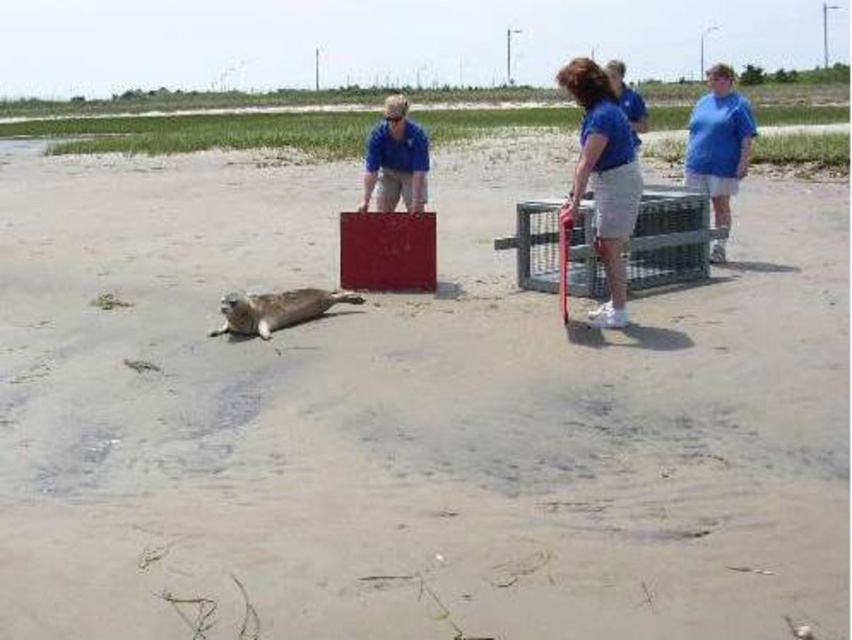
Question: Which point appears closest to the camera in this image?

Choices:
 (A) (392, 124)
 (B) (628, 186)
 (C) (712, 184)

Answer: (B)

Question: Is matte blue shirt at center below gray fur seal at center?

Choices:
 (A) no
 (B) yes

Answer: (A)

Question: Does blue cotton shirt at center come behind gray fur seal at center?

Choices:
 (A) no
 (B) yes

Answer: (A)

Question: Estimate the real-world distances between objects in this image. Which object is farther from the blue cotton shirt at center?

Choices:
 (A) gray fur seal at center
 (B) matte blue shirt at center
 (C) blue cotton shirt at right

Answer: (C)

Question: Does blue cotton shirt at center have a larger size compared to gray fur seal at center?

Choices:
 (A) no
 (B) yes

Answer: (B)

Question: Among these points, which one is nearest to the camera?

Choices:
 (A) (424, 193)
 (B) (622, 205)
 (C) (743, 99)

Answer: (B)